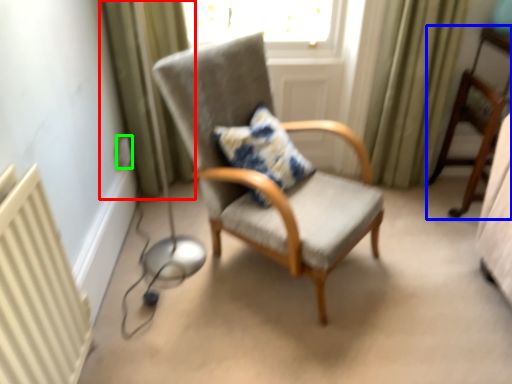
Question: Which is nearer to the curtain (highlighted by a red box)? chair (highlighted by a blue box) or electric outlet (highlighted by a green box).

Choices:
 (A) chair
 (B) electric outlet

Answer: (B)